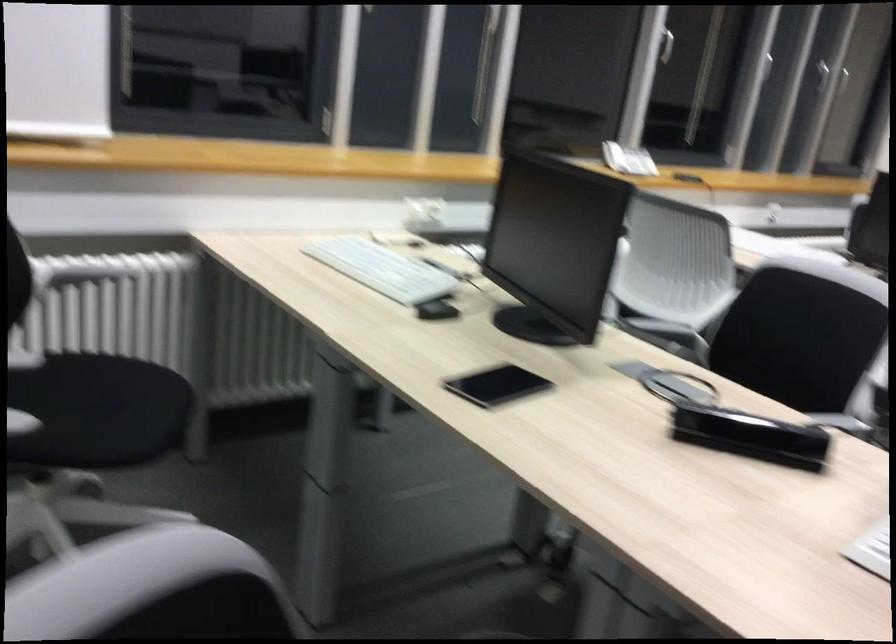
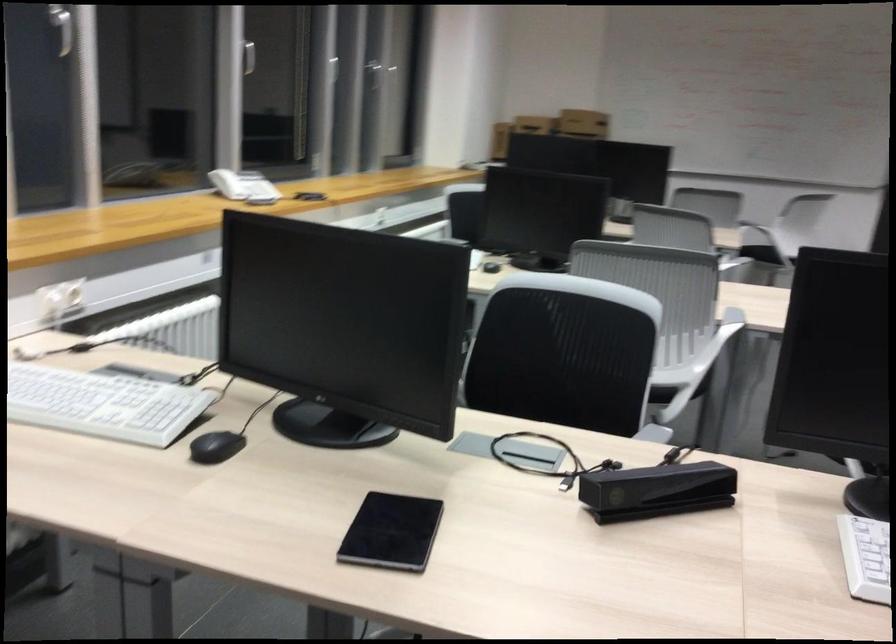
Locate, in the second image, the point that corresponds to (x=437, y=310) in the first image.

(216, 447)